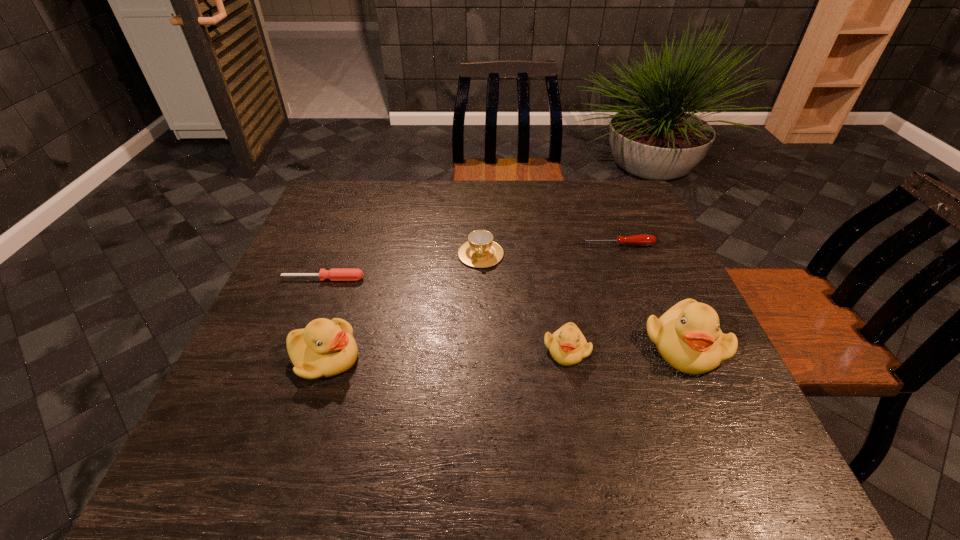
You are a GUI agent. You are given a task and a screenshot of the screen. Output one action in this format:
    pyautogui.click(x=<x>, y=<y>)
    Task: Click on the free spot between the second tallest object and the shortest duckling
    This screenshot has height=540, width=960.
    Given the screenshot: What is the action you would take?
    [x=445, y=354]

The height and width of the screenshot is (540, 960). In order to click on free space that is in between the right screwdriver and the leftmost duckling in this screenshot , I will do `click(470, 301)`.

Find the location of a particular element. free point between the cup and the farther screwdriver is located at coordinates (549, 249).

Image resolution: width=960 pixels, height=540 pixels. What are the coordinates of `unoccupied position between the cup and the leftmost duckling` in the screenshot? It's located at (402, 306).

Find the location of a particular element. The height and width of the screenshot is (540, 960). empty space between the rightmost duckling and the left screwdriver is located at coordinates (504, 312).

Locate an element on the screen. The width and height of the screenshot is (960, 540). object that is the second closest to the leftmost duckling is located at coordinates (480, 251).

The image size is (960, 540). I want to click on object that is the closest to the left screwdriver, so click(x=325, y=348).

Point out which duckling is positioned as the second nearest to the fourth shortest object. Please provide its 2D coordinates. Your answer should be formatted as a tuple, i.e. [(x, y)], where the tuple contains the x and y coordinates of a point satisfying the conditions above.

[(325, 348)]

Select which duckling appears as the closest to the shortest duckling. Please provide its 2D coordinates. Your answer should be formatted as a tuple, i.e. [(x, y)], where the tuple contains the x and y coordinates of a point satisfying the conditions above.

[(688, 337)]

Where is `vacant space that satisfies the following two spatial constraints: 1. on the back side of the fourth nearest object; 2. on the right side of the farther screwdriver`? vacant space that satisfies the following two spatial constraints: 1. on the back side of the fourth nearest object; 2. on the right side of the farther screwdriver is located at coordinates (337, 245).